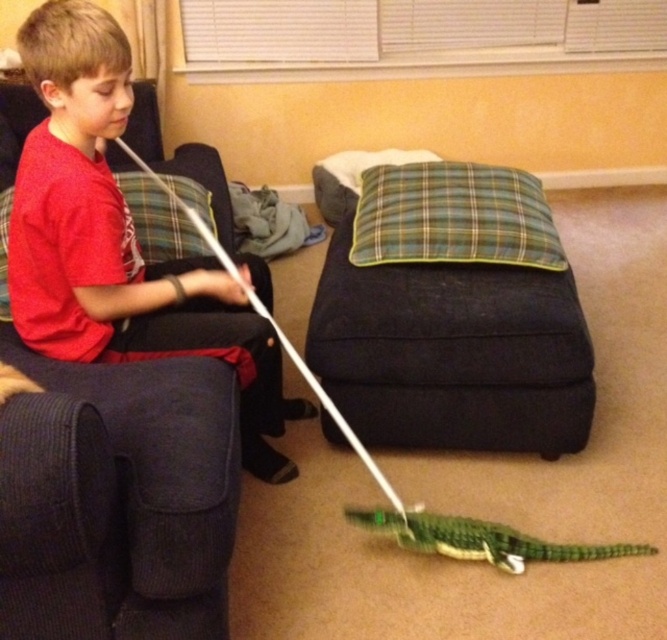
Is point (362, 358) positioned before point (255, 388)?

No, (362, 358) is behind (255, 388).

Between point (562, 355) and point (103, 339), which one is positioned behind?

Point (562, 355)

Does point (406, 189) come farther from viewer compared to point (235, 324)?

Yes, point (406, 189) is farther from viewer.

Image resolution: width=667 pixels, height=640 pixels. Find the location of `green plaid pillow at center`. green plaid pillow at center is located at coordinates (454, 317).